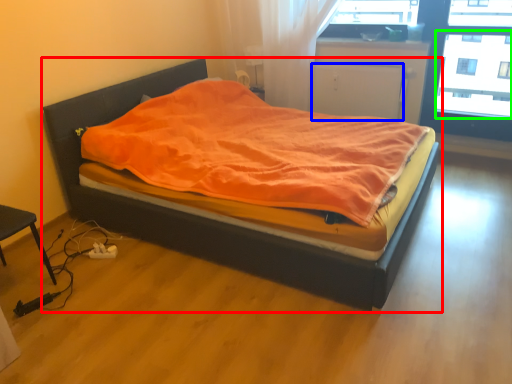
Question: Which object is positioned farthest from bed (highlighted by a red box)? Select from screen door (highlighted by a blue box) and window screen (highlighted by a green box).

Choices:
 (A) screen door
 (B) window screen

Answer: (B)